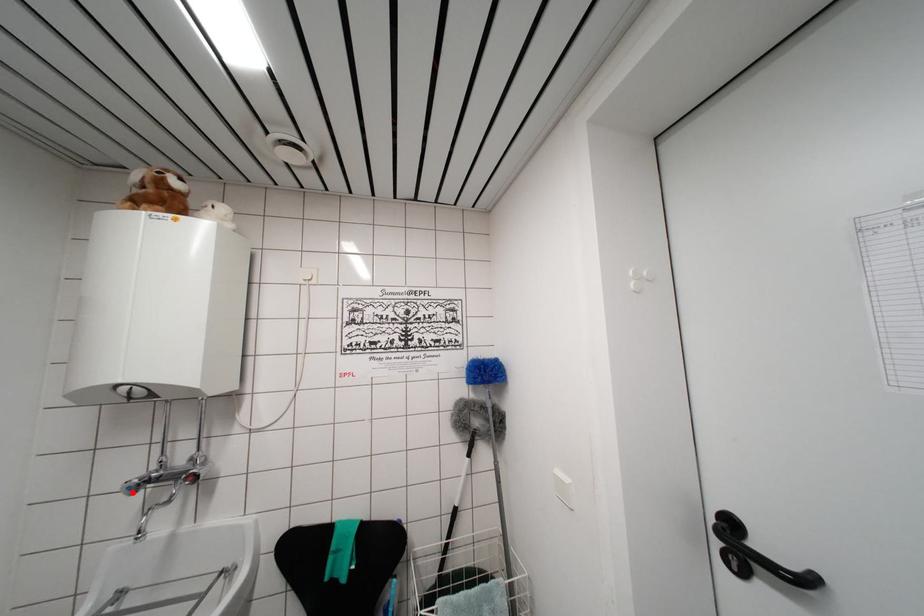
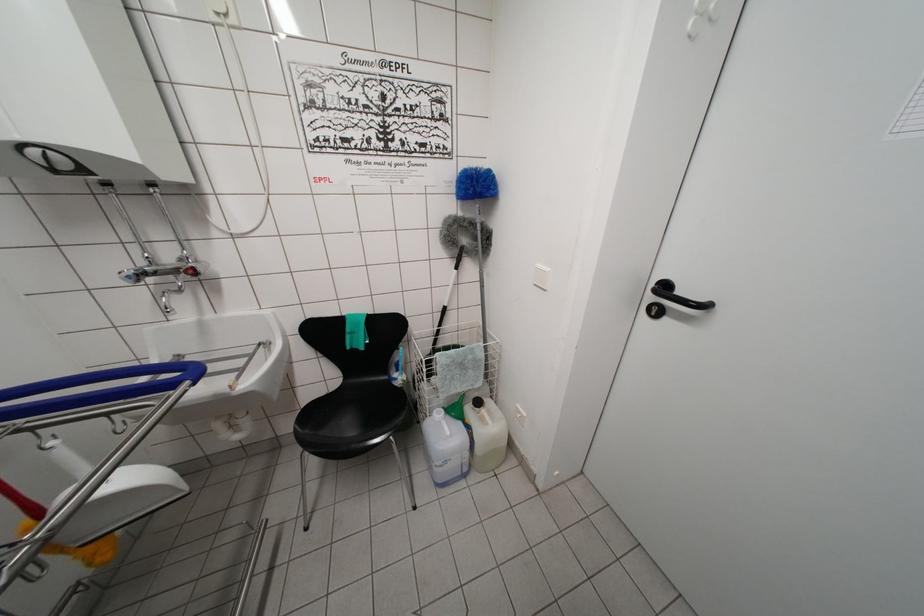
Locate, in the second image, the point that corresponds to the highlighted location in the first image.

(131, 282)